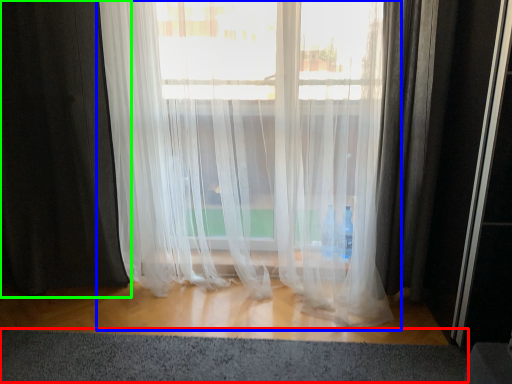
Question: Which object is the farthest from gray (highlighted by a red box)? Choose among these: curtain (highlighted by a blue box) or curtain (highlighted by a green box).

Choices:
 (A) curtain
 (B) curtain

Answer: (B)